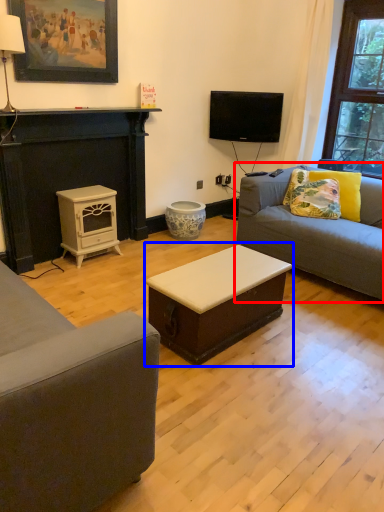
Question: Which object is further to the camera taking this photo, studio couch (highlighted by a red box) or table (highlighted by a blue box)?

Choices:
 (A) studio couch
 (B) table

Answer: (A)